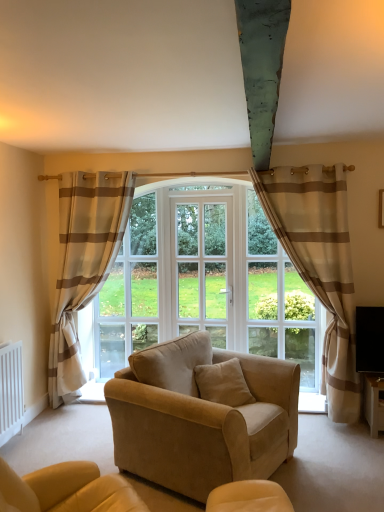
Where is `unoccupied area in front of beige striped curtain at right, the second curtain from the left`? This screenshot has width=384, height=512. unoccupied area in front of beige striped curtain at right, the second curtain from the left is located at coordinates (340, 455).